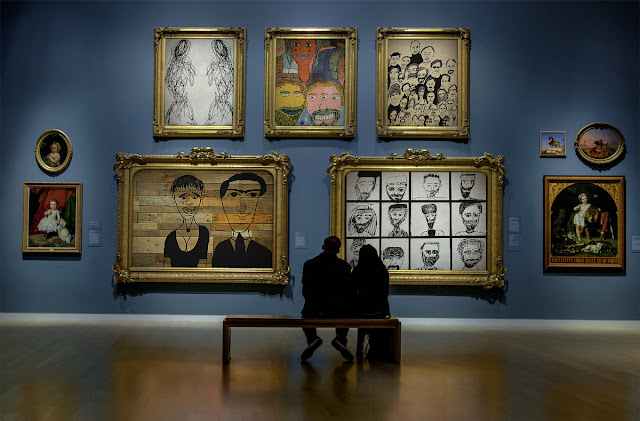
You are a GUI agent. You are given a task and a screenshot of the screen. Output one action in this format:
    pyautogui.click(x=<x>, y=<y>)
    Task: Click on the bench
    The image size is (640, 421).
    Given the screenshot: What is the action you would take?
    285,320